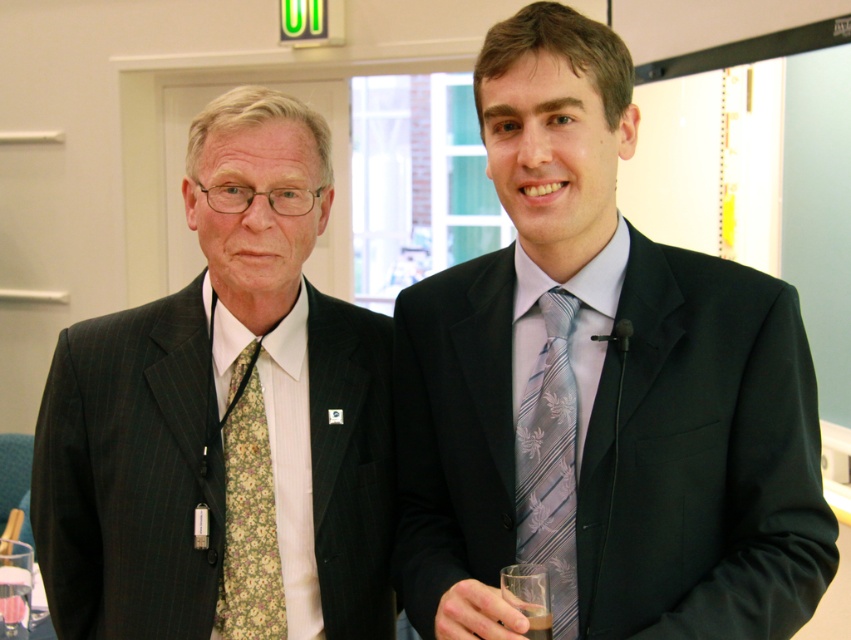
Question: Which of the following is the farthest from the observer?

Choices:
 (A) floral-patterned fabric tie at left
 (B) silk tie at center
 (C) translucent glass at lower right
 (D) silvery-gray floral tie at center-right

Answer: (A)

Question: Can you confirm if silvery-gray floral tie at center-right is positioned above floral-patterned fabric tie at left?

Choices:
 (A) yes
 (B) no

Answer: (A)

Question: Which point is closer to the camera?

Choices:
 (A) floral-patterned fabric tie at left
 (B) translucent glass at lower right
 (C) silk tie at center

Answer: (C)

Question: Which point appears farthest from the camera in this image?

Choices:
 (A) (438, 353)
 (B) (557, 419)
 (C) (232, 536)

Answer: (C)

Question: Can you confirm if silk tie at center is positioned above pinstriped suit at left?

Choices:
 (A) no
 (B) yes

Answer: (B)

Question: Is pinstriped suit at left positioned in front of floral-patterned fabric tie at left?

Choices:
 (A) yes
 (B) no

Answer: (A)